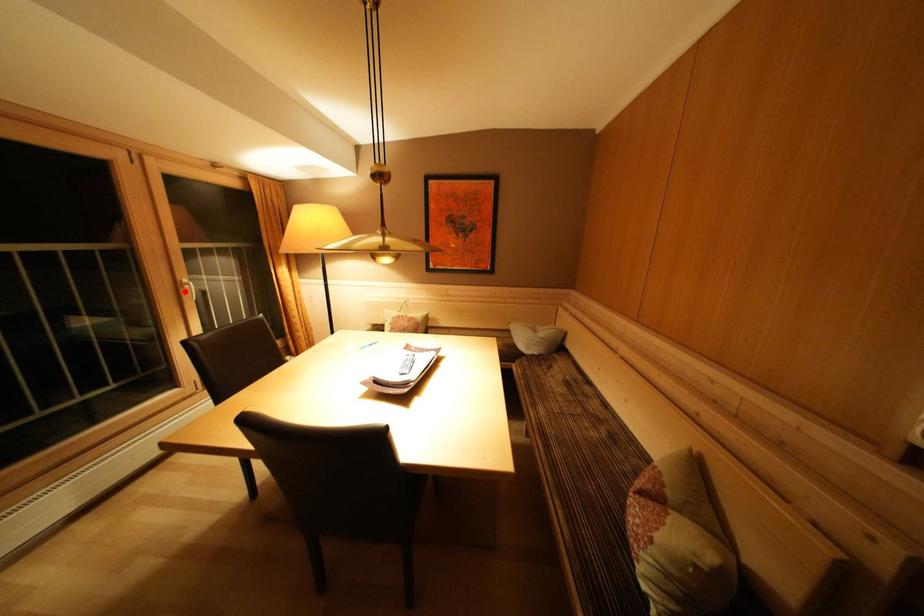
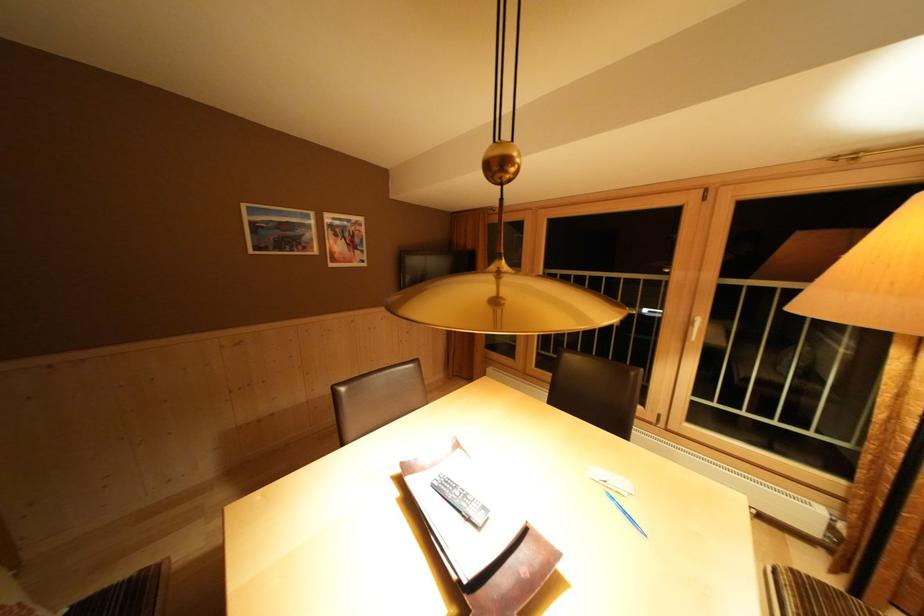
Question: I am providing you with two images of the same scene from different viewpoints. A red point is shown in image1. For the corresponding object point in image2, is it positioned nearer or farther from the camera?

Choices:
 (A) Nearer
 (B) Farther

Answer: (B)